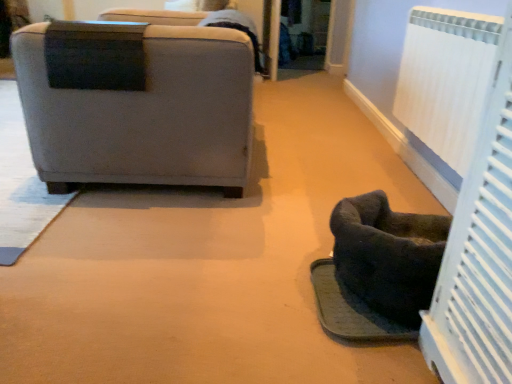
Find the location of a particular element. The image size is (512, 384). dark fabric pet bed at lower right is located at coordinates (388, 255).

Describe the element at coordinates (350, 309) in the screenshot. I see `dark gray fabric footrest at lower right` at that location.

Image resolution: width=512 pixels, height=384 pixels. I want to click on dark gray fabric footrest at lower right, so click(350, 309).

The width and height of the screenshot is (512, 384). What do you see at coordinates (145, 114) in the screenshot?
I see `gray fabric chair at left` at bounding box center [145, 114].

At what (x,y) coordinates should I click in order to perform the action: click on dark fabric pet bed at lower right. Please return your answer as a coordinate pair (x, y). The image size is (512, 384). Looking at the image, I should click on (388, 255).

From the image's perspective, relative to dark fabric pet bed at lower right, is dark gray fabric footrest at lower right above or below?

dark gray fabric footrest at lower right is situated lower than dark fabric pet bed at lower right in the image.

In the scene shown: Do you think dark gray fabric footrest at lower right is within dark fabric pet bed at lower right, or outside of it?

dark gray fabric footrest at lower right is located beyond the bounds of dark fabric pet bed at lower right.

Considering the positions of objects dark gray fabric footrest at lower right and dark fabric pet bed at lower right in the image provided, who is behind, dark gray fabric footrest at lower right or dark fabric pet bed at lower right?

dark gray fabric footrest at lower right is behind.

Is dark gray fabric footrest at lower right oriented away from dark fabric pet bed at lower right?

dark gray fabric footrest at lower right is not turned away from dark fabric pet bed at lower right.

Which is in front, dark gray fabric footrest at lower right or white textured radiator at right?

Positioned in front is dark gray fabric footrest at lower right.

Considering the sizes of objects dark gray fabric footrest at lower right and white textured radiator at right in the image provided, who is wider, dark gray fabric footrest at lower right or white textured radiator at right?

Wider between the two is dark gray fabric footrest at lower right.

From a real-world perspective, who is located higher, dark gray fabric footrest at lower right or white textured radiator at right?

white textured radiator at right, from a real-world perspective.

Who is bigger, white textured radiator at right or dark gray fabric footrest at lower right?

white textured radiator at right.

From a real-world perspective, between white textured radiator at right and dark gray fabric footrest at lower right, who is vertically higher?

Result: From a 3D spatial view, white textured radiator at right is above.

How much distance is there between white textured radiator at right and dark gray fabric footrest at lower right?

white textured radiator at right is 37.42 inches from dark gray fabric footrest at lower right.

Would you say white textured radiator at right is part of dark fabric pet bed at lower right's contents?

That's incorrect, white textured radiator at right is not inside dark fabric pet bed at lower right.

Are dark fabric pet bed at lower right and white textured radiator at right making contact?

No, dark fabric pet bed at lower right is not making contact with white textured radiator at right.

From the image's perspective, would you say dark fabric pet bed at lower right is positioned over white textured radiator at right?

No.

Is dark fabric pet bed at lower right oriented towards dark gray fabric footrest at lower right?

No, dark fabric pet bed at lower right is not oriented towards dark gray fabric footrest at lower right.

Which is correct: dark fabric pet bed at lower right is inside dark gray fabric footrest at lower right, or outside of it?

dark fabric pet bed at lower right cannot be found inside dark gray fabric footrest at lower right.

Based on the photo, from a real-world perspective, is dark fabric pet bed at lower right located beneath dark gray fabric footrest at lower right?

No, from a real-world perspective, dark fabric pet bed at lower right is not below dark gray fabric footrest at lower right.

How distant is dark fabric pet bed at lower right from dark gray fabric footrest at lower right?

dark fabric pet bed at lower right and dark gray fabric footrest at lower right are 5.92 inches apart.

Is dark fabric pet bed at lower right at the back of white textured radiator at right?

That's not correct — white textured radiator at right is not looking away from dark fabric pet bed at lower right.

Is dark fabric pet bed at lower right a part of white textured radiator at right?

That's incorrect, dark fabric pet bed at lower right is not inside white textured radiator at right.

How many degrees apart are the facing directions of white textured radiator at right and dark fabric pet bed at lower right?

The facing directions of white textured radiator at right and dark fabric pet bed at lower right are 2.56 degrees apart.

Are dark fabric pet bed at lower right and gray fabric chair at left far apart?

No, dark fabric pet bed at lower right is not far from gray fabric chair at left.

Is dark fabric pet bed at lower right in front of gray fabric chair at left?

Yes, it is in front of gray fabric chair at left.

From the image's perspective, relative to gray fabric chair at left, is dark fabric pet bed at lower right above or below?

Result: Clearly, from the image's perspective, dark fabric pet bed at lower right is below gray fabric chair at left.

Where is `furniture below the gray fabric chair at left (from a real-world perspective)`? Image resolution: width=512 pixels, height=384 pixels. furniture below the gray fabric chair at left (from a real-world perspective) is located at coordinates (388, 255).

This screenshot has height=384, width=512. What are the coordinates of `furniture in front of the dark gray fabric footrest at lower right` in the screenshot? It's located at (388, 255).

You are a GUI agent. You are given a task and a screenshot of the screen. Output one action in this format:
    pyautogui.click(x=<x>, y=<y>)
    Task: Click on the radiator behind the dark gray fabric footrest at lower right
    
    Given the screenshot: What is the action you would take?
    pyautogui.click(x=445, y=79)

When comparing their distances from dark fabric pet bed at lower right, does white textured radiator at right or dark gray fabric footrest at lower right seem further?

white textured radiator at right is positioned further to the anchor dark fabric pet bed at lower right.

From the image, which object appears to be nearer to white textured radiator at right, dark gray fabric footrest at lower right or dark fabric pet bed at lower right?

Based on the image, dark fabric pet bed at lower right appears to be nearer to white textured radiator at right.

When comparing their distances from dark gray fabric footrest at lower right, does white textured radiator at right or dark fabric pet bed at lower right seem further?

Based on the image, white textured radiator at right appears to be further to dark gray fabric footrest at lower right.

Based on their spatial positions, is white textured radiator at right or dark gray fabric footrest at lower right further from gray fabric chair at left?

white textured radiator at right lies further to gray fabric chair at left than the other object.

Consider the image. Considering their positions, is dark fabric pet bed at lower right positioned closer to dark gray fabric footrest at lower right than white textured radiator at right?

dark fabric pet bed at lower right is positioned closer to the anchor dark gray fabric footrest at lower right.

Looking at the image, which one is located further to gray fabric chair at left, dark fabric pet bed at lower right or white textured radiator at right?

white textured radiator at right is positioned further to the anchor gray fabric chair at left.

Which object lies nearer to the anchor point dark fabric pet bed at lower right, dark gray fabric footrest at lower right or gray fabric chair at left?

dark gray fabric footrest at lower right lies closer to dark fabric pet bed at lower right than the other object.

Which object lies further to the anchor point white textured radiator at right, dark fabric pet bed at lower right or dark gray fabric footrest at lower right?

dark gray fabric footrest at lower right lies further to white textured radiator at right than the other object.

In order to click on furniture between white textured radiator at right and dark gray fabric footrest at lower right from top to bottom in this screenshot , I will do `click(388, 255)`.

You are a GUI agent. You are given a task and a screenshot of the screen. Output one action in this format:
    pyautogui.click(x=<x>, y=<y>)
    Task: Click on the footrest located between gray fabric chair at left and white textured radiator at right in the left-right direction
    This screenshot has height=384, width=512.
    Given the screenshot: What is the action you would take?
    pyautogui.click(x=350, y=309)

In order to click on the footrest situated between gray fabric chair at left and dark fabric pet bed at lower right from left to right in this screenshot , I will do `click(350, 309)`.

You are a GUI agent. You are given a task and a screenshot of the screen. Output one action in this format:
    pyautogui.click(x=<x>, y=<y>)
    Task: Click on the furniture between gray fabric chair at left and white textured radiator at right
    This screenshot has height=384, width=512.
    Given the screenshot: What is the action you would take?
    pyautogui.click(x=388, y=255)